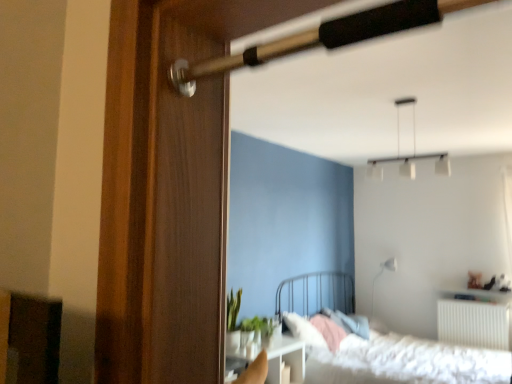
Identify the location of green matte plant at center. Image resolution: width=512 pixels, height=384 pixels. (258, 326).

Locate an element on the screen. This screenshot has height=384, width=512. wooden screen door at left is located at coordinates (168, 190).

What do you see at coordinates (168, 190) in the screenshot?
I see `wooden screen door at left` at bounding box center [168, 190].

In order to face wooden door handle at upper center, should I rotate leftwards or rightwards?

Turn right by 6.200 degrees to look at wooden door handle at upper center.

What are the coordinates of `wooden door handle at upper center` in the screenshot? It's located at (314, 40).

What do you see at coordinates (381, 274) in the screenshot? This screenshot has height=384, width=512. I see `white glossy lamp at upper right, the 1th lamp positioned from the back` at bounding box center [381, 274].

Identify the location of white glossy lamp at upper right, marked as the second lamp in a front-to-back arrangement. 381,274.

Find the location of `green matte plant at center`. green matte plant at center is located at coordinates (258, 326).

Can white glossy table at lower center be found inside white matte pendant light at upper center, which is counted as the 2th lamp, starting from the right?

No.

Considering the relative sizes of white matte pendant light at upper center, which is counted as the 2th lamp, starting from the right, and white glossy table at lower center in the image provided, is white matte pendant light at upper center, which is counted as the 2th lamp, starting from the right, wider than white glossy table at lower center?

No.

At what (x,y) coordinates should I click in order to perform the action: click on lamp in front of the white glossy table at lower center. Please return your answer as a coordinate pair (x, y). Looking at the image, I should click on (408, 155).

Can you confirm if white fluffy bed at lower right is taller than white glossy lamp at upper right, the second lamp when ordered from left to right?

Yes, white fluffy bed at lower right is taller than white glossy lamp at upper right, the second lamp when ordered from left to right.

Is white fluffy bed at lower right in front of white glossy lamp at upper right, the second lamp when ordered from left to right?

Yes.

How much distance is there between white fluffy bed at lower right and white glossy lamp at upper right, the 1th lamp in the right-to-left sequence?

1.71 meters.

Does white fluffy bed at lower right turn towards white glossy lamp at upper right, the 1th lamp positioned from the back?

No, white fluffy bed at lower right is not oriented towards white glossy lamp at upper right, the 1th lamp positioned from the back.

Between point (275, 372) and point (395, 265), which one is positioned behind?

The point (395, 265) is farther from the camera.

Which of these two, white glossy table at lower center or white glossy lamp at upper right, the 1th lamp positioned from the back, stands taller?

With more height is white glossy lamp at upper right, the 1th lamp positioned from the back.

Can we say white glossy table at lower center lies outside white glossy lamp at upper right, marked as the 1th lamp in a bottom-to-top arrangement?

Absolutely, white glossy table at lower center is external to white glossy lamp at upper right, marked as the 1th lamp in a bottom-to-top arrangement.

Is the depth of white glossy lamp at upper right, which ranks as the 2th lamp in top-to-bottom order, greater than that of wooden screen door at left?

That is True.

Considering the relative sizes of white glossy lamp at upper right, which ranks as the 2th lamp in top-to-bottom order, and wooden screen door at left in the image provided, is white glossy lamp at upper right, which ranks as the 2th lamp in top-to-bottom order, shorter than wooden screen door at left?

Indeed, white glossy lamp at upper right, which ranks as the 2th lamp in top-to-bottom order, has a lesser height compared to wooden screen door at left.

Based on their sizes in the image, would you say white glossy lamp at upper right, marked as the second lamp in a front-to-back arrangement, is bigger or smaller than wooden screen door at left?

white glossy lamp at upper right, marked as the second lamp in a front-to-back arrangement, is smaller than wooden screen door at left.

The width and height of the screenshot is (512, 384). In order to click on lamp directly beneath the wooden cabinet at lower left (from a real-world perspective) in this screenshot , I will do `click(381, 274)`.

Is white glossy lamp at upper right, the second lamp when ordered from left to right, next to wooden cabinet at lower left?

No, white glossy lamp at upper right, the second lamp when ordered from left to right, is not beside wooden cabinet at lower left.

How many degrees apart are the facing directions of white glossy lamp at upper right, marked as the 1th lamp in a bottom-to-top arrangement, and wooden cabinet at lower left?

They differ by 84.5 degrees in their facing directions.

Considering the relative sizes of white glossy lamp at upper right, the 1th lamp in the right-to-left sequence, and wooden cabinet at lower left in the image provided, is white glossy lamp at upper right, the 1th lamp in the right-to-left sequence, thinner than wooden cabinet at lower left?

Yes, white glossy lamp at upper right, the 1th lamp in the right-to-left sequence, is thinner than wooden cabinet at lower left.

From the image's perspective, is white fluffy bed at lower right located above or below white glossy table at lower center?

white fluffy bed at lower right is situated higher than white glossy table at lower center in the image.

From a real-world perspective, is white fluffy bed at lower right positioned under white glossy table at lower center based on gravity?

No.

Is white fluffy bed at lower right not close to white glossy table at lower center?

No, white fluffy bed at lower right is not far away from white glossy table at lower center.

Is point (373, 351) positioned in front of point (279, 375)?

No, it is behind (279, 375).

At what (x,y) coordinates should I click in order to perform the action: click on radiator that appears below the green matte plant at center (from a real-world perspective). Please return your answer as a coordinate pair (x, y). This screenshot has width=512, height=384. Looking at the image, I should click on (475, 323).

From the picture: From their relative heights in the image, would you say white plastic radiator at lower right is taller or shorter than green matte plant at center?

Considering their sizes, white plastic radiator at lower right has more height than green matte plant at center.

Which point is more forward, (488, 311) or (270, 331)?

The point (270, 331) is closer.

Identify the location of lamp in front of the white glossy table at lower center. The height and width of the screenshot is (384, 512). (408, 155).

Locate an element on the screen. This screenshot has width=512, height=384. the 1st lamp above the white fluffy bed at lower right (from a real-world perspective) is located at coordinates (381, 274).

Considering their positions, is wooden screen door at left positioned closer to green matte plant at center than white glossy lamp at upper right, marked as the second lamp in a front-to-back arrangement?

white glossy lamp at upper right, marked as the second lamp in a front-to-back arrangement, is positioned closer to the anchor green matte plant at center.

Looking at the image, which one is located further to green matte plant at center, white matte pendant light at upper center, which ranks as the 2th lamp in back-to-front order, or white plastic radiator at lower right?

white plastic radiator at lower right is further to green matte plant at center.

In the scene shown: Looking at the image, which one is located closer to white glossy table at lower center, green matte plant at center or white fluffy bed at lower right?

Based on the image, green matte plant at center appears to be nearer to white glossy table at lower center.

Based on their spatial positions, is wooden screen door at left or white glossy lamp at upper right, which ranks as the 2th lamp in top-to-bottom order, closer to white matte pendant light at upper center, which is counted as the 2th lamp, starting from the right?

white glossy lamp at upper right, which ranks as the 2th lamp in top-to-bottom order, is closer to white matte pendant light at upper center, which is counted as the 2th lamp, starting from the right.

Considering their positions, is white glossy lamp at upper right, marked as the second lamp in a front-to-back arrangement, positioned further to white plastic radiator at lower right than white fluffy bed at lower right?

Based on the image, white fluffy bed at lower right appears to be further to white plastic radiator at lower right.

Based on their spatial positions, is white glossy table at lower center or wooden screen door at left closer to green matte plant at center?

The object closer to green matte plant at center is white glossy table at lower center.

Estimate the real-world distances between objects in this image. Which object is further from wooden door handle at upper center, white glossy table at lower center or wooden cabinet at lower left?

Among the two, white glossy table at lower center is located further to wooden door handle at upper center.

Which object lies further to the anchor point green matte plant at center, white glossy table at lower center or white matte pendant light at upper center, acting as the first lamp starting from the left?

The object further to green matte plant at center is white matte pendant light at upper center, acting as the first lamp starting from the left.

The image size is (512, 384). In order to click on table between white fluffy bed at lower right and white glossy lamp at upper right, which ranks as the 2th lamp in top-to-bottom order, along the z-axis in this screenshot , I will do `click(286, 359)`.

What are the coordinates of `radiator between wooden cabinet at lower left and white glossy lamp at upper right, the 1th lamp positioned from the back, in the front-back direction` in the screenshot? It's located at (x=475, y=323).

At what (x,y) coordinates should I click in order to perform the action: click on bed between white matte pendant light at upper center, acting as the first lamp starting from the left, and white glossy table at lower center, in the vertical direction. Please return your answer as a coordinate pair (x, y). The width and height of the screenshot is (512, 384). Looking at the image, I should click on (377, 344).

The image size is (512, 384). I want to click on bed between green matte plant at center and white plastic radiator at lower right, so click(x=377, y=344).